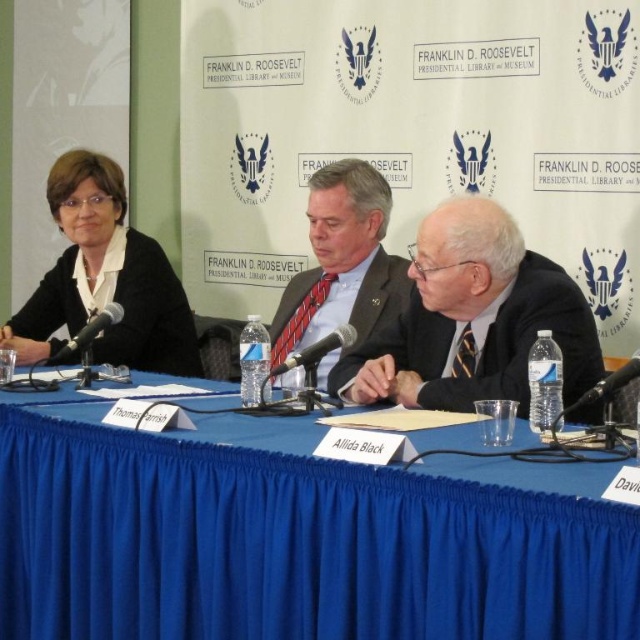
Between point (396, 536) and point (451, 324), which one is positioned behind?

Positioned behind is point (451, 324).

Is point (61, 536) farther from viewer compared to point (412, 362)?

No, it is not.

Is point (497, 534) more distant than point (378, 381)?

That is False.

This screenshot has width=640, height=640. Find the location of `blue fabric table at center`. blue fabric table at center is located at coordinates (296, 536).

Does point (269, 518) come behind point (307, 289)?

That is False.

Between point (0, 576) and point (362, 168), which one is positioned in front?

Point (0, 576) is more forward.

Where is `blue fabric table at center`? The height and width of the screenshot is (640, 640). blue fabric table at center is located at coordinates (296, 536).

Where is `blue fabric table at center`? blue fabric table at center is located at coordinates (296, 536).

How distant is blue fabric table at center from matte black jacket at left?

blue fabric table at center is 1.08 meters away from matte black jacket at left.

Does point (134, 460) come in front of point (104, 173)?

That is True.

Where is `blue fabric table at center`? blue fabric table at center is located at coordinates (296, 536).